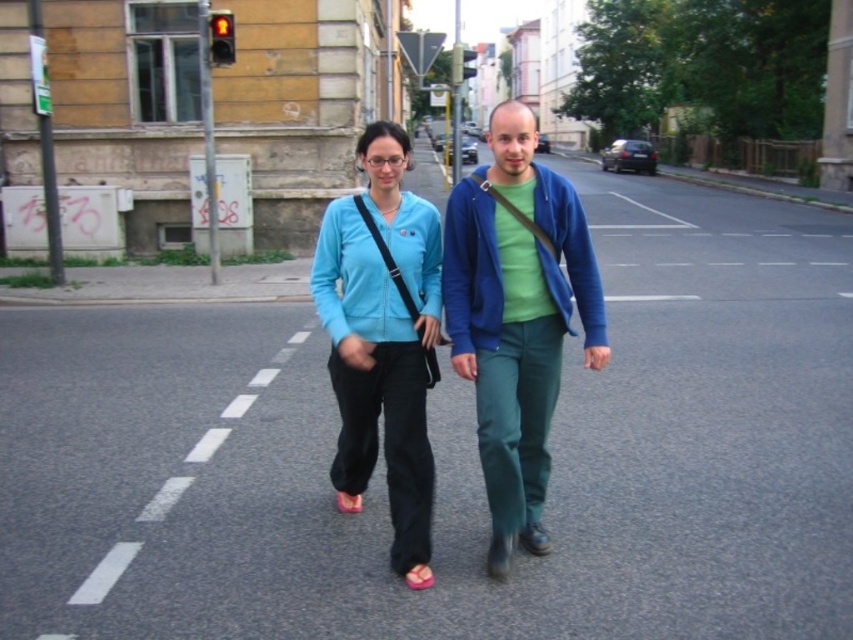
Is matte blue jacket at center smaller than matte blue sweater at center?

No.

Is point (563, 228) positioned behind point (422, 515)?

That is True.

Between point (517, 508) and point (415, 561), which one is positioned in front?

Positioned in front is point (415, 561).

The height and width of the screenshot is (640, 853). I want to click on matte blue jacket at center, so click(x=515, y=317).